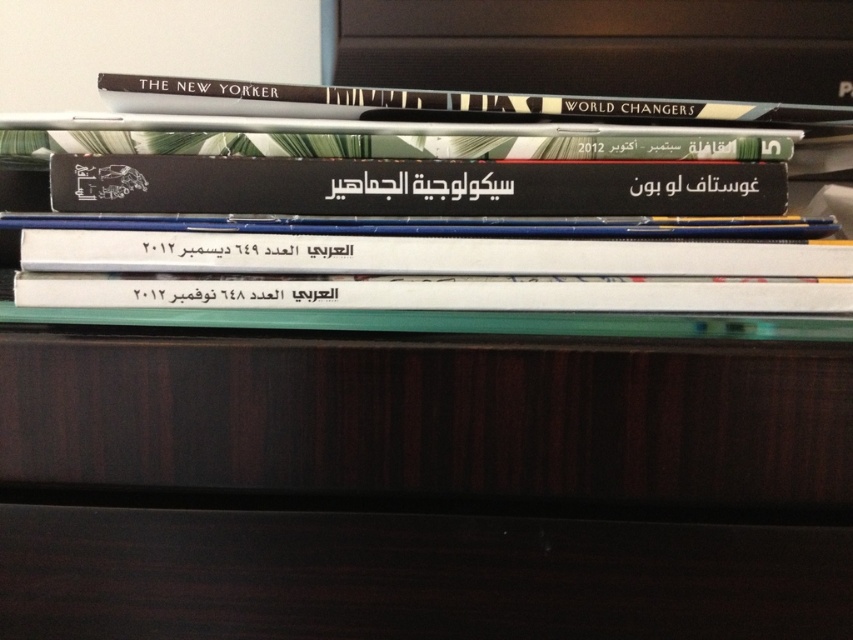
Question: Which point is farther to the camera?

Choices:
 (A) (68, 301)
 (B) (700, 244)

Answer: (B)

Question: Which point appears farthest from the camera in this image?

Choices:
 (A) (354, 284)
 (B) (204, 198)
 (C) (538, 104)
 (D) (207, 260)

Answer: (C)

Question: Is white paper book at center below hardcover book at upper center?

Choices:
 (A) yes
 (B) no

Answer: (A)

Question: Is white paper at center closer to the viewer compared to hardcover book at upper center?

Choices:
 (A) no
 (B) yes

Answer: (B)

Question: Observing the image, what is the correct spatial positioning of white paper at center in reference to hardcover book at upper center?

Choices:
 (A) left
 (B) right

Answer: (A)

Question: Estimate the real-world distances between objects in this image. Which object is closer to the hardcover book at upper center?

Choices:
 (A) white paper book at center
 (B) black matte book at center
 (C) white paper at center

Answer: (B)